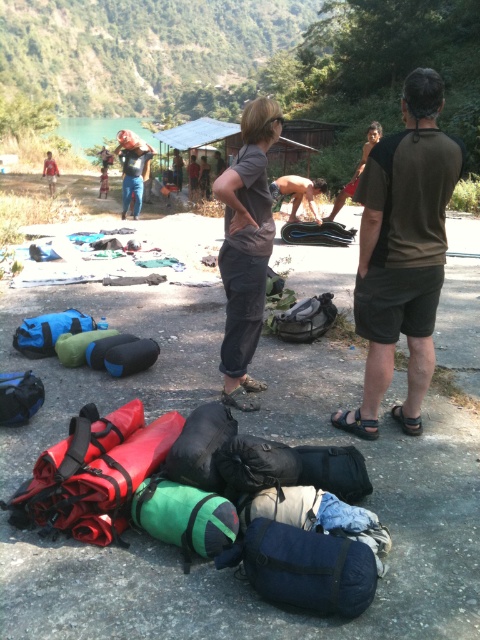
You are planning to take a photo of the shiny black shirt at center and the smooth skin woman at center. Which object is narrower in width?

The shiny black shirt at center has a lesser width compared to the smooth skin woman at center, so the shiny black shirt at center is narrower in width.

You are packing for a hiking trip and need to choose between the matte blue jeans at center and the shiny black shirt at center. Which item takes up more space in your backpack?

The matte blue jeans at center has a larger size compared to the shiny black shirt at center, so it takes up more space in the backpack.